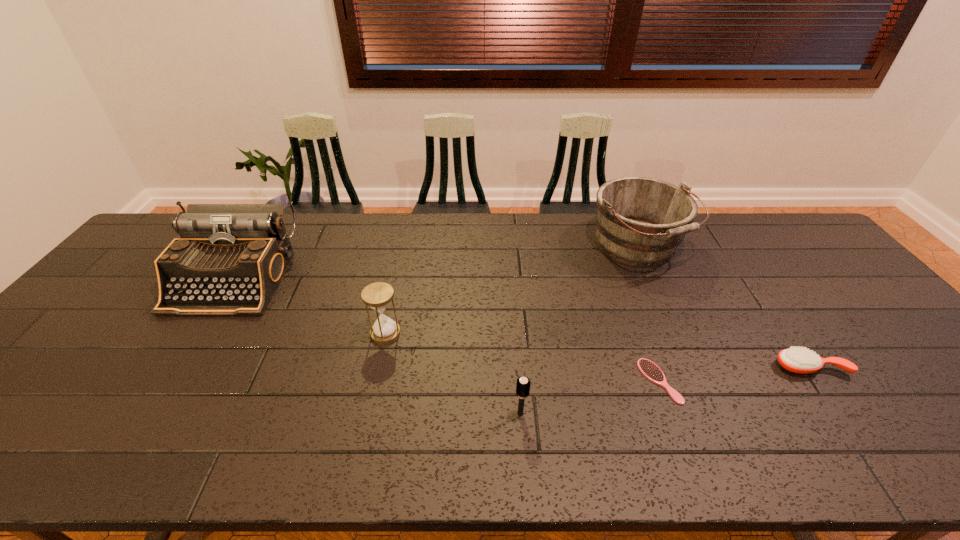
You are a GUI agent. You are given a task and a screenshot of the screen. Output one action in this format:
    pyautogui.click(x=<x>, y=<y>)
    Task: Click on the vacant region located 0.240m on the right of the wine bucket
    This screenshot has width=960, height=540.
    Given the screenshot: What is the action you would take?
    pyautogui.click(x=760, y=246)

Find the location of `vacant region located 0.070m on the keyboard of the leftmost object`. vacant region located 0.070m on the keyboard of the leftmost object is located at coordinates (196, 337).

Identify the location of free location located 0.310m on the left of the hourglass. This screenshot has height=540, width=960. (252, 333).

Locate an element on the screen. This screenshot has width=960, height=540. vacant space located 0.350m on the back of the fourth object from right to left is located at coordinates (512, 299).

Where is `free space located 0.100m on the front of the second tallest hairbrush`? free space located 0.100m on the front of the second tallest hairbrush is located at coordinates (844, 415).

Find the location of a particular element. Image resolution: width=960 pixels, height=540 pixels. blank space located on the back of the shortest object is located at coordinates (637, 321).

Where is `wine bucket that is at the far edge`? The width and height of the screenshot is (960, 540). wine bucket that is at the far edge is located at coordinates (640, 221).

Image resolution: width=960 pixels, height=540 pixels. I want to click on typewriter located in the far edge section of the desktop, so click(229, 259).

This screenshot has width=960, height=540. Find the location of `vacant space at the near edge of the desktop`. vacant space at the near edge of the desktop is located at coordinates (244, 428).

The image size is (960, 540). Identify the location of free space at the left edge. (65, 341).